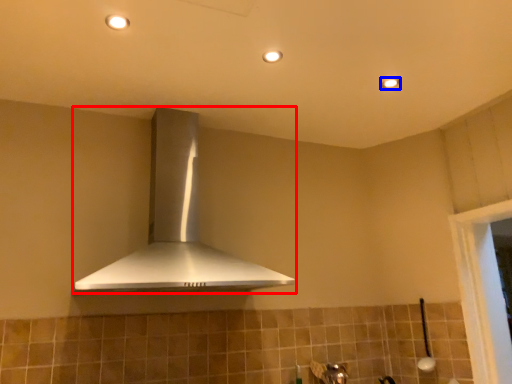
Question: Which object appears closest to the camera in this image, home appliance (highlighted by a red box) or light fixture (highlighted by a blue box)?

Choices:
 (A) home appliance
 (B) light fixture

Answer: (A)